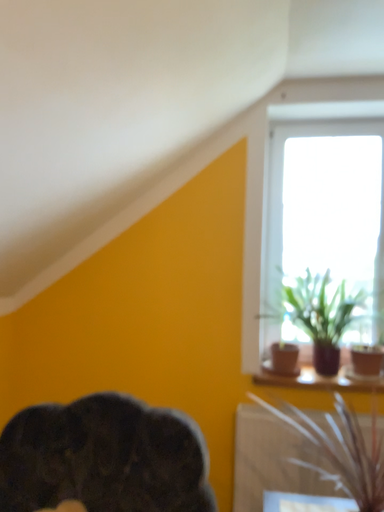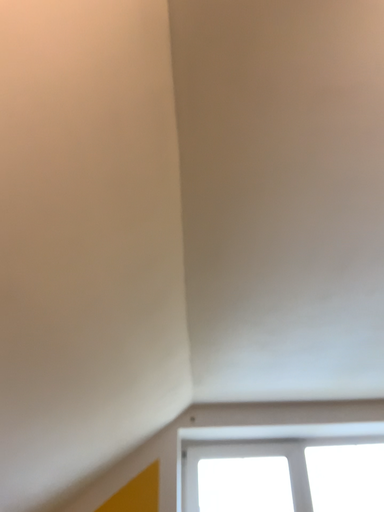
Question: Which way did the camera rotate in the video?

Choices:
 (A) rotated downward
 (B) rotated upward

Answer: (B)